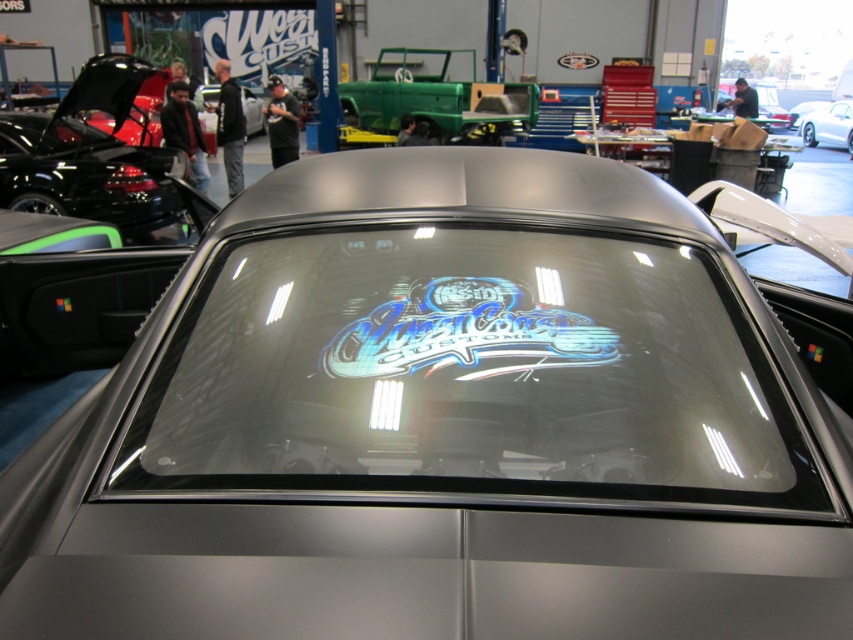
Describe the element at coordinates (468, 372) in the screenshot. This screenshot has width=853, height=640. I see `transparent glass windshield at center` at that location.

Where is `transparent glass windshield at center`? transparent glass windshield at center is located at coordinates (468, 372).

Who is positioned more to the right, satin silver car at center or matte black car at center?

satin silver car at center

Where is `satin silver car at center`? This screenshot has width=853, height=640. satin silver car at center is located at coordinates (828, 125).

Measure the distance between satin silver car at center and camera.

satin silver car at center is 19.12 meters from camera.

This screenshot has height=640, width=853. What are the coordinates of `satin silver car at center` in the screenshot? It's located at (828, 125).

Can you confirm if matte black car at left is positioned below satin silver car at center?

Indeed, matte black car at left is positioned under satin silver car at center.

Who is more distant from viewer, (151,156) or (802,131)?

Positioned behind is point (802,131).

The image size is (853, 640). What are the coordinates of `matte black car at left` in the screenshot? It's located at (90, 156).